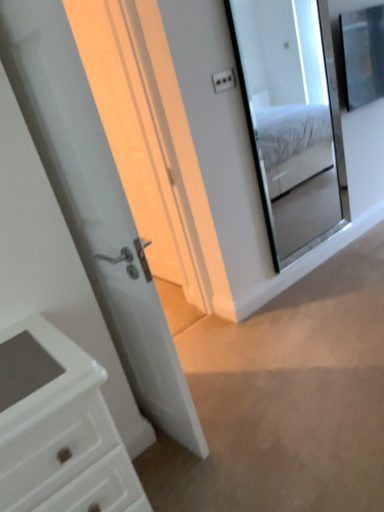
Question: From the image's perspective, is clear glass mirror at upper right above white glossy door at center?

Choices:
 (A) no
 (B) yes

Answer: (B)

Question: Is clear glass mirror at upper right positioned in front of white glossy door at center?

Choices:
 (A) yes
 (B) no

Answer: (B)

Question: From the image's perspective, would you say clear glass mirror at upper right is shown under white glossy door at center?

Choices:
 (A) yes
 (B) no

Answer: (B)

Question: Could you tell me if clear glass mirror at upper right is turned towards white glossy door at center?

Choices:
 (A) yes
 (B) no

Answer: (B)

Question: Is the position of clear glass mirror at upper right more distant than that of white glossy door at center?

Choices:
 (A) no
 (B) yes

Answer: (B)

Question: Would you say clear glass mirror at upper right is outside white glossy door at center?

Choices:
 (A) no
 (B) yes

Answer: (B)

Question: From a real-world perspective, is white glossy door at center positioned over white glossy door at center based on gravity?

Choices:
 (A) yes
 (B) no

Answer: (B)

Question: Does white glossy door at center appear on the right side of white glossy door at center?

Choices:
 (A) no
 (B) yes

Answer: (A)

Question: From the image's perspective, is white glossy door at center beneath white glossy door at center?

Choices:
 (A) no
 (B) yes

Answer: (B)

Question: Can you confirm if white glossy door at center is shorter than white glossy door at center?

Choices:
 (A) no
 (B) yes

Answer: (B)

Question: From the image's perspective, is white glossy door at center over white glossy door at center?

Choices:
 (A) yes
 (B) no

Answer: (B)

Question: Does white glossy door at center have a larger size compared to white glossy door at center?

Choices:
 (A) yes
 (B) no

Answer: (A)

Question: Is clear glass mirror at upper right with white glossy door at center?

Choices:
 (A) no
 (B) yes

Answer: (A)